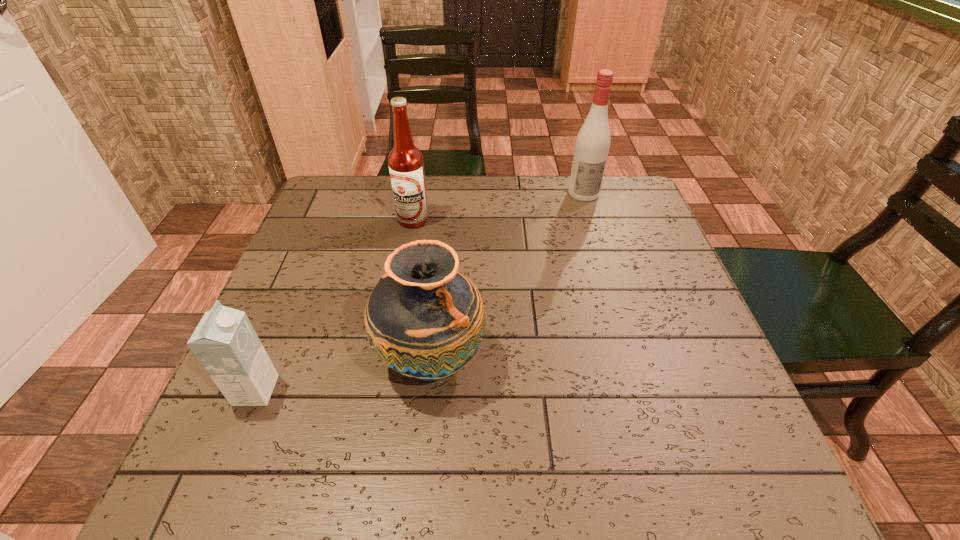
Locate which object is the closest to the leftmost object. Please provide its 2D coordinates. Your answer should be formatted as a tuple, i.e. [(x, y)], where the tuple contains the x and y coordinates of a point satisfying the conditions above.

[(423, 319)]

The height and width of the screenshot is (540, 960). In order to click on vacant space that satisfies the following two spatial constraints: 1. on the label of the rightmost object; 2. on the front label of the carton in this screenshot , I will do `click(643, 390)`.